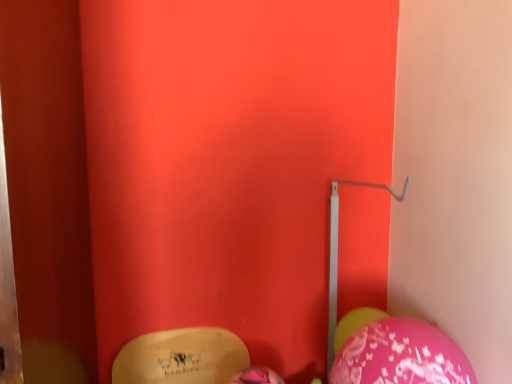
Question: From the image's perspective, is metallic silver trim at center-right located above or below pink glossy balloon at lower right, the 1th balloon viewed from the front?

Choices:
 (A) above
 (B) below

Answer: (A)

Question: Would you say metallic silver trim at center-right is inside or outside pink glossy balloon at lower right, which appears as the 1th balloon when viewed from the left?

Choices:
 (A) outside
 (B) inside

Answer: (A)

Question: Considering the real-world distances, which object is closest to the metallic silver trim at center-right?

Choices:
 (A) pink glossy balloon at lower right, which appears as the 2th balloon when viewed from the left
 (B) pink glossy balloon at lower right, which appears as the 1th balloon when viewed from the left

Answer: (A)

Question: Estimate the real-world distances between objects in this image. Which object is farther from the pink glossy balloon at lower right, the 2th balloon positioned from the right?

Choices:
 (A) pink glossy balloon at lower right, positioned as the 2th balloon in front-to-back order
 (B) metallic silver trim at center-right

Answer: (B)